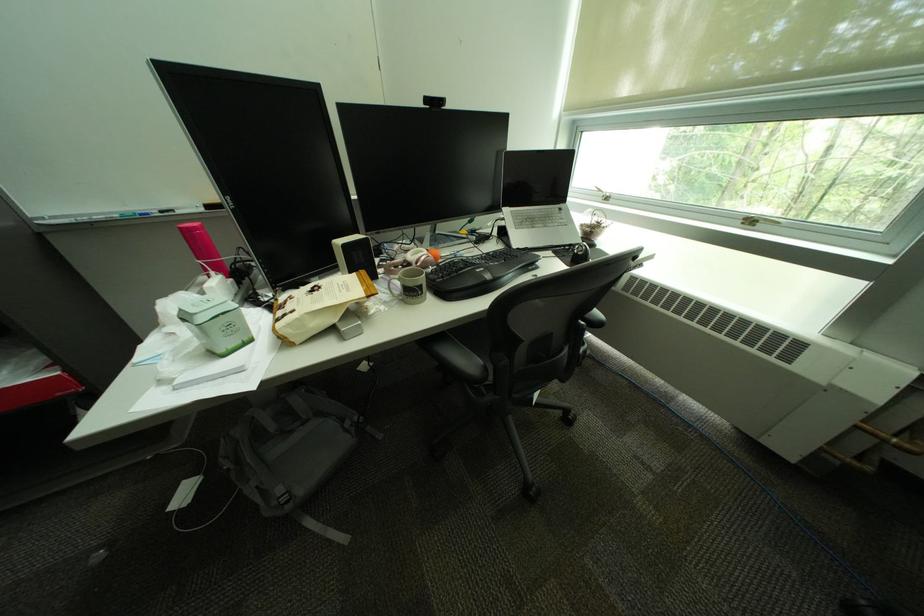
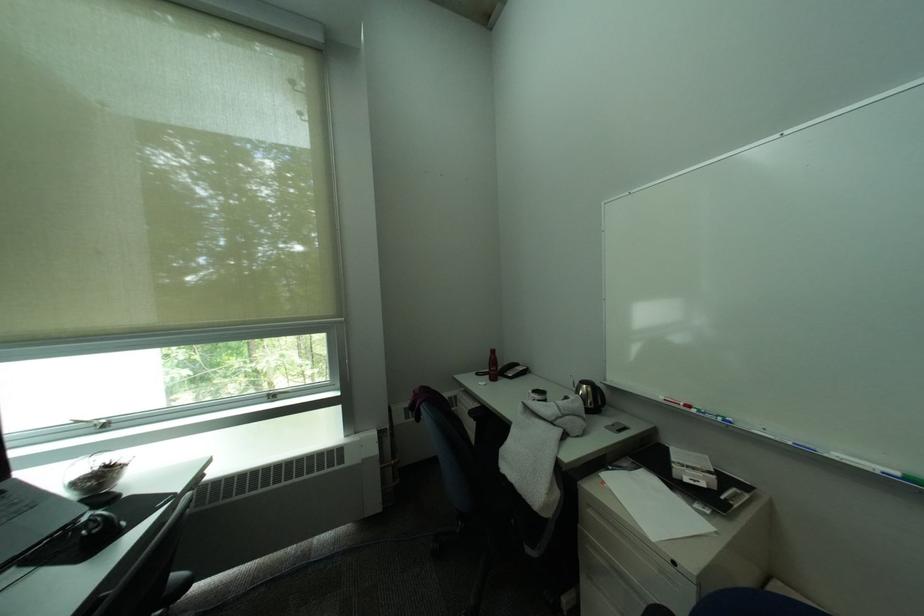
Question: The camera is either moving clockwise (left) or counter-clockwise (right) around the object. The first image is from the beginning of the video and the second image is from the end. Is the camera moving left or right when shooting the video?

Choices:
 (A) Left
 (B) Right

Answer: (A)